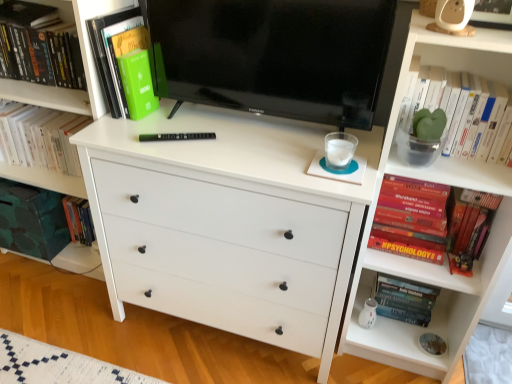
Where is `free space in front of green matte book at upper left, positioned as the 2th book in left-to-right order`? The width and height of the screenshot is (512, 384). free space in front of green matte book at upper left, positioned as the 2th book in left-to-right order is located at coordinates (131, 134).